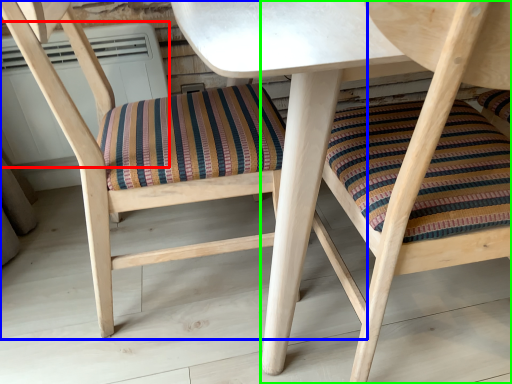
Question: Which is nearer to the air conditioner (highlighted by a red box)? chair (highlighted by a blue box) or chair (highlighted by a green box).

Choices:
 (A) chair
 (B) chair

Answer: (A)